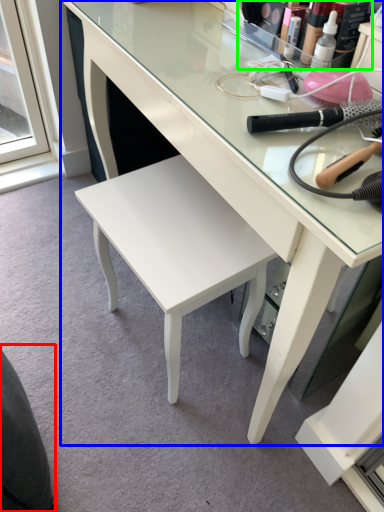
Question: Estimate the real-world distances between objects in this image. Which object is closer to swivel chair (highlighted by a red box), desk (highlighted by a blue box) or toiletry (highlighted by a green box)?

Choices:
 (A) desk
 (B) toiletry

Answer: (A)